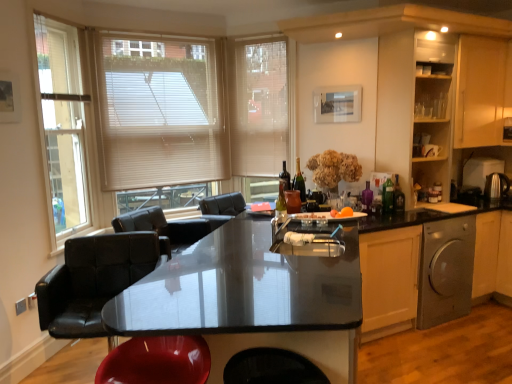
Describe the element at coordinates (415, 109) in the screenshot. I see `matte wooden cabinet at right, arranged as the first cabinetry when viewed from the left` at that location.

Describe the element at coordinates (496, 186) in the screenshot. This screenshot has height=384, width=512. I see `polished stainless steel kettle at right, positioned as the second appliance in back-to-front order` at that location.

What is the approximate width of beige blinds at upper left?

beige blinds at upper left is 9.16 centimeters in width.

You are a GUI agent. You are given a task and a screenshot of the screen. Output one action in this format:
    pyautogui.click(x=<x>, y=<y>)
    Task: Click on the translucent glass bottle at center, acting as the second bottle starting from the back
    
    Given the screenshot: What is the action you would take?
    pyautogui.click(x=367, y=197)

This screenshot has height=384, width=512. What do you see at coordinates (367, 197) in the screenshot?
I see `translucent glass bottle at center, arranged as the second bottle when viewed from the front` at bounding box center [367, 197].

Where is `satin silver dishwasher at lower right`? Image resolution: width=512 pixels, height=384 pixels. satin silver dishwasher at lower right is located at coordinates (446, 271).

At what (x,y) coordinates should I click in order to perform the action: click on matte wooden cabinet at right, which is the 2th cabinetry in right-to-left order. Please return your answer as a coordinate pair (x, y). Looking at the image, I should click on (415, 109).

From the image's perspective, is orange matte fruit at center located above or below black leather chair at lower left?

Clearly, from the image's perspective, orange matte fruit at center is above black leather chair at lower left.

From a real-world perspective, who is located lower, orange matte fruit at center or black leather chair at lower left?

From a 3D spatial view, black leather chair at lower left is below.

Which object is wider, orange matte fruit at center or black leather chair at lower left?

black leather chair at lower left.

Who is smaller, orange matte fruit at center or black leather chair at lower left?

Smaller between the two is orange matte fruit at center.

The width and height of the screenshot is (512, 384). I want to click on chair below the shiny dark glass wine bottle at center (from the image's perspective), so click(x=94, y=280).

From a real-world perspective, is black leather chair at lower left positioned above or below shiny dark glass wine bottle at center?

From a real-world perspective, black leather chair at lower left is physically below shiny dark glass wine bottle at center.

From the image's perspective, is black leather chair at lower left located above or below shiny dark glass wine bottle at center?

black leather chair at lower left is situated lower than shiny dark glass wine bottle at center in the image.

Which object is thinner, translucent glass bottle at center, which is the second bottle from right to left, or orange matte fruit at center?

Thinner between the two is translucent glass bottle at center, which is the second bottle from right to left.

Does translucent glass bottle at center, which is the second bottle from right to left, have a greater height compared to orange matte fruit at center?

Indeed, translucent glass bottle at center, which is the second bottle from right to left, has a greater height compared to orange matte fruit at center.

Which point is more forward, (x=364, y=204) or (x=337, y=215)?

The point (x=337, y=215) is closer.

From the image's perspective, is matte wooden cabinet at right, arranged as the first cabinetry when viewed from the left, on beige fabric blind at upper center?

No, from the image's perspective, matte wooden cabinet at right, arranged as the first cabinetry when viewed from the left, is not over beige fabric blind at upper center.

Looking at this image, is matte wooden cabinet at right, arranged as the first cabinetry when viewed from the left, oriented towards beige fabric blind at upper center?

No, matte wooden cabinet at right, arranged as the first cabinetry when viewed from the left, is not aimed at beige fabric blind at upper center.

Looking at the image, does matte wooden cabinet at right, which is the 2th cabinetry in right-to-left order, seem bigger or smaller compared to beige fabric blind at upper center?

In the image, matte wooden cabinet at right, which is the 2th cabinetry in right-to-left order, appears to be larger than beige fabric blind at upper center.

From a real-world perspective, relative to beige fabric blind at upper center, is matte wooden cabinet at right, which is the 2th cabinetry in right-to-left order, vertically above or below?

From a real-world perspective, matte wooden cabinet at right, which is the 2th cabinetry in right-to-left order, is physically below beige fabric blind at upper center.

From the glossy black countertop at center, count 2nd cabinetry to the right and point to it. Please provide its 2D coordinates.

[(480, 91)]

Does wooden cabinet at upper right, the 1th cabinetry in the right-to-left sequence, have a greater width compared to glossy black countertop at center?

No, wooden cabinet at upper right, the 1th cabinetry in the right-to-left sequence, is not wider than glossy black countertop at center.

Can we say wooden cabinet at upper right, the 2th cabinetry from the left, lies outside glossy black countertop at center?

Yes, wooden cabinet at upper right, the 2th cabinetry from the left, is outside of glossy black countertop at center.

Considering the positions of point (442, 231) and point (218, 256), is point (442, 231) closer or farther from the camera than point (218, 256)?

Point (442, 231) is positioned closer to the camera compared to point (218, 256).

Between satin silver dishwasher at lower right and glossy black countertop at center, which one has smaller width?

satin silver dishwasher at lower right.

Is glossy black countertop at center at the back of satin silver dishwasher at lower right?

satin silver dishwasher at lower right is not turned away from glossy black countertop at center.

Visually, is satin silver dishwasher at lower right positioned to the left or to the right of glossy black countertop at center?

satin silver dishwasher at lower right is positioned on glossy black countertop at center's right side.

Does point (415, 82) come behind point (280, 206)?

That is False.

In the scene shown: Is matte wooden cabinet at right, arranged as the first cabinetry when viewed from the left, at the left side of green glass bottle at center, which appears as the 3th bottle when viewed from the right?

No.

Is matte wooden cabinet at right, arranged as the first cabinetry when viewed from the left, wider than green glass bottle at center, which is the first bottle from left to right?

Indeed, matte wooden cabinet at right, arranged as the first cabinetry when viewed from the left, has a greater width compared to green glass bottle at center, which is the first bottle from left to right.

Is matte wooden cabinet at right, arranged as the first cabinetry when viewed from the left, not close to green glass bottle at center, which is the first bottle from left to right?

Yes, matte wooden cabinet at right, arranged as the first cabinetry when viewed from the left, and green glass bottle at center, which is the first bottle from left to right, are located far from each other.

At what (x,y) coordinates should I click in order to perform the action: click on food that is above the black leather chair at lower left (from a real-world perspective). Please return your answer as a coordinate pair (x, y). Image resolution: width=512 pixels, height=384 pixels. Looking at the image, I should click on (342, 213).

The image size is (512, 384). I want to click on chair in front of the shiny dark glass wine bottle at center, so click(94, 280).

From the image, which object appears to be farther from glossy black countertop at center, orange matte fruit at center or translucent glass bottle at center, which is counted as the 2th bottle, starting from the left?

translucent glass bottle at center, which is counted as the 2th bottle, starting from the left, lies further to glossy black countertop at center than the other object.

Which object lies nearer to the anchor point green glass bottle at center, which is the first bottle from left to right, black leather chair at lower left or polished stainless steel kettle at right, positioned as the second appliance in back-to-front order?

black leather chair at lower left lies closer to green glass bottle at center, which is the first bottle from left to right, than the other object.

Estimate the real-world distances between objects in this image. Which object is closer to green glass bottle at center, matte wooden cabinet at right, arranged as the first cabinetry when viewed from the left, or green glass bottle at center, which is the first bottle from left to right?

Based on the image, green glass bottle at center, which is the first bottle from left to right, appears to be nearer to green glass bottle at center.

Based on their spatial positions, is matte wooden cabinet at right, which is the 2th cabinetry in right-to-left order, or green glass bottle at center, which is the first bottle from left to right, closer to wooden cabinet at upper right, the 1th cabinetry in the right-to-left sequence?

matte wooden cabinet at right, which is the 2th cabinetry in right-to-left order, is positioned closer to the anchor wooden cabinet at upper right, the 1th cabinetry in the right-to-left sequence.

Based on their spatial positions, is satin silver dishwasher at lower right or beige fabric blind at upper center further from shiny dark glass wine bottle at center?

satin silver dishwasher at lower right lies further to shiny dark glass wine bottle at center than the other object.

When comparing their distances from wooden cabinet at upper right, the 1th cabinetry in the right-to-left sequence, does green glass bottle at center, which is the third bottle in back-to-front order, or satin silver dishwasher at lower right seem closer?

satin silver dishwasher at lower right is positioned closer to the anchor wooden cabinet at upper right, the 1th cabinetry in the right-to-left sequence.

Consider the image. Looking at the image, which one is located further to black leather chair at lower left, matte wooden cabinet at right, which is the 2th cabinetry in right-to-left order, or polished stainless steel kettle at right, positioned as the second appliance in back-to-front order?

polished stainless steel kettle at right, positioned as the second appliance in back-to-front order, is positioned further to the anchor black leather chair at lower left.

Considering their positions, is matte wooden cabinet at right, arranged as the first cabinetry when viewed from the left, positioned closer to green glass bottle at center than black leather chair at lower left?

matte wooden cabinet at right, arranged as the first cabinetry when viewed from the left.

I want to click on wine bottle between beige blinds at upper left and green glass bottle at upper right, acting as the 1th bottle starting from the right, so pyautogui.click(x=285, y=177).

Find the location of a particular element. Image resolution: width=512 pixels, height=384 pixels. bottle between green glass bottle at center, which is the third bottle in back-to-front order, and green glass bottle at upper right, acting as the 3th bottle starting from the left, from left to right is located at coordinates (367, 197).

Image resolution: width=512 pixels, height=384 pixels. Find the location of `blind between black leather chair at lower left and polished stainless steel kettle at right, marked as the first appliance in a back-to-front arrangement, in the horizontal direction`. blind between black leather chair at lower left and polished stainless steel kettle at right, marked as the first appliance in a back-to-front arrangement, in the horizontal direction is located at coordinates (260, 107).

Find the location of a particular element. dish washer between green glass bottle at center, which is the third bottle in back-to-front order, and polished stainless steel kettle at right, marked as the first appliance in a back-to-front arrangement is located at coordinates (446, 271).